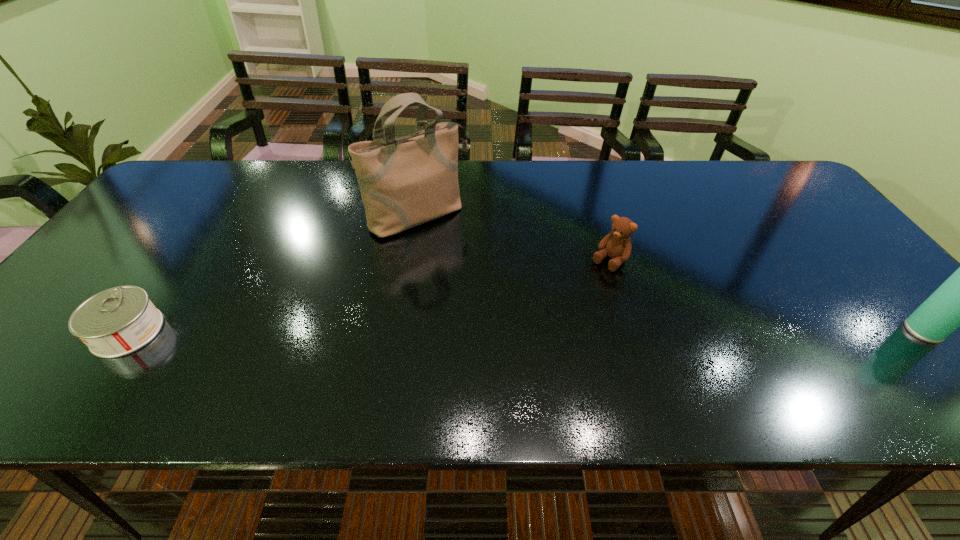
Identify the location of object that ranks as the closest to the third object from left to right. The height and width of the screenshot is (540, 960). (404, 182).

This screenshot has width=960, height=540. In order to click on free space that satisfies the following two spatial constraints: 1. on the back side of the can; 2. on the left side of the second farthest object in this screenshot , I will do `click(178, 261)`.

At what (x,y) coordinates should I click in order to perform the action: click on vacant space that satisfies the following two spatial constraints: 1. on the front side of the third shortest object; 2. on the left side of the third object from left to right. Please return your answer as a coordinate pair (x, y). Looking at the image, I should click on (631, 331).